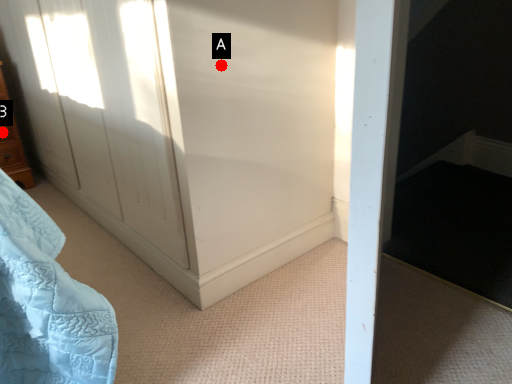
Question: Two points are circled on the image, labeled by A and B beside each circle. Among these points, which one is nearest to the camera?

Choices:
 (A) A is closer
 (B) B is closer

Answer: (A)